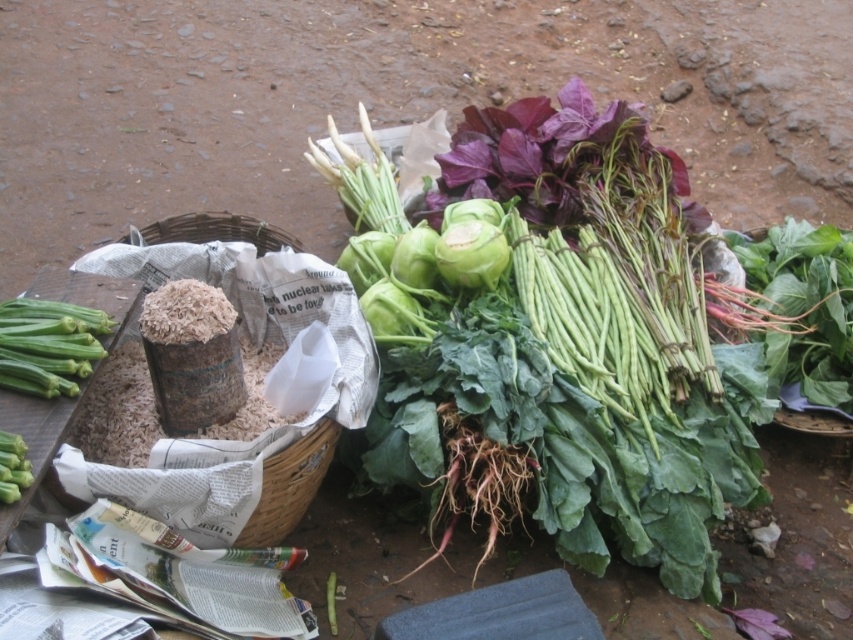
Is green leafy vegetables at center thinner than brown woven basket at left?

In fact, green leafy vegetables at center might be wider than brown woven basket at left.

Can you confirm if green leafy vegetables at center is positioned to the left of brown woven basket at left?

In fact, green leafy vegetables at center is to the right of brown woven basket at left.

Consider the image. Measure the distance between point (682, 500) and camera.

Point (682, 500) is 5.74 feet away from camera.

This screenshot has height=640, width=853. Find the location of `green leafy vegetables at center`. green leafy vegetables at center is located at coordinates (573, 436).

Is green leafy vegetables at center below green matte okra at lower left?

Incorrect, green leafy vegetables at center is not positioned below green matte okra at lower left.

Which is behind, point (718, 499) or point (15, 493)?

The point (718, 499) is more distant.

Does point (469, 397) come closer to viewer compared to point (10, 480)?

That is False.

This screenshot has height=640, width=853. I want to click on green leafy vegetables at center, so click(x=573, y=436).

Is green leafy stem at left shorter than green matte okra at lower left?

In fact, green leafy stem at left may be taller than green matte okra at lower left.

Is point (109, 330) farther from viewer compared to point (10, 465)?

Yes, it is behind point (10, 465).

This screenshot has width=853, height=640. I want to click on green leafy stem at left, so click(x=48, y=344).

This screenshot has width=853, height=640. What are the coordinates of `green leafy stem at left` in the screenshot? It's located at (48, 344).